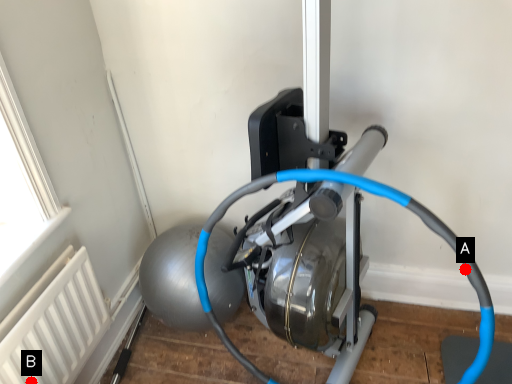
Question: Two points are circled on the image, labeled by A and B beside each circle. Which point is farther to the camera?

Choices:
 (A) A is further
 (B) B is further

Answer: (A)